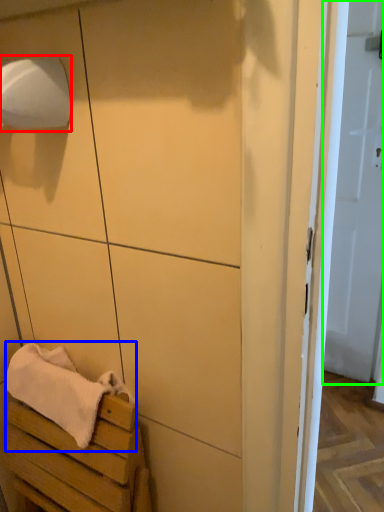
Question: Which is nearer to the toilet paper (highlighted by a red box)? bath towel (highlighted by a blue box) or door (highlighted by a green box).

Choices:
 (A) bath towel
 (B) door

Answer: (A)